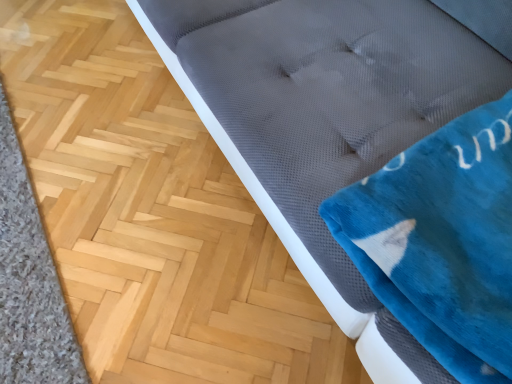
Question: Could you tell me if velvety blue blanket at upper right is facing gray carpet at lower left?

Choices:
 (A) yes
 (B) no

Answer: (B)

Question: From the image's perspective, is velvety blue blanket at upper right beneath gray carpet at lower left?

Choices:
 (A) yes
 (B) no

Answer: (B)

Question: Does velvety blue blanket at upper right have a lesser height compared to gray carpet at lower left?

Choices:
 (A) no
 (B) yes

Answer: (A)

Question: Does velvety blue blanket at upper right lie in front of gray carpet at lower left?

Choices:
 (A) no
 (B) yes

Answer: (B)

Question: Considering the relative sizes of velvety blue blanket at upper right and gray carpet at lower left in the image provided, is velvety blue blanket at upper right wider than gray carpet at lower left?

Choices:
 (A) yes
 (B) no

Answer: (A)

Question: Considering the relative sizes of velvety blue blanket at upper right and gray carpet at lower left in the image provided, is velvety blue blanket at upper right thinner than gray carpet at lower left?

Choices:
 (A) no
 (B) yes

Answer: (A)

Question: Can you confirm if gray carpet at lower left is positioned to the left of velvety blue blanket at upper right?

Choices:
 (A) no
 (B) yes

Answer: (B)

Question: Is gray carpet at lower left turned away from velvety blue blanket at upper right?

Choices:
 (A) no
 (B) yes

Answer: (A)

Question: Does gray carpet at lower left turn towards velvety blue blanket at upper right?

Choices:
 (A) no
 (B) yes

Answer: (A)

Question: Does gray carpet at lower left have a greater height compared to velvety blue blanket at upper right?

Choices:
 (A) yes
 (B) no

Answer: (B)

Question: Is gray carpet at lower left at the right side of velvety blue blanket at upper right?

Choices:
 (A) yes
 (B) no

Answer: (B)

Question: Can you confirm if gray carpet at lower left is wider than velvety blue blanket at upper right?

Choices:
 (A) yes
 (B) no

Answer: (B)

Question: Is gray carpet at lower left situated inside velvety blue blanket at upper right or outside?

Choices:
 (A) outside
 (B) inside

Answer: (A)